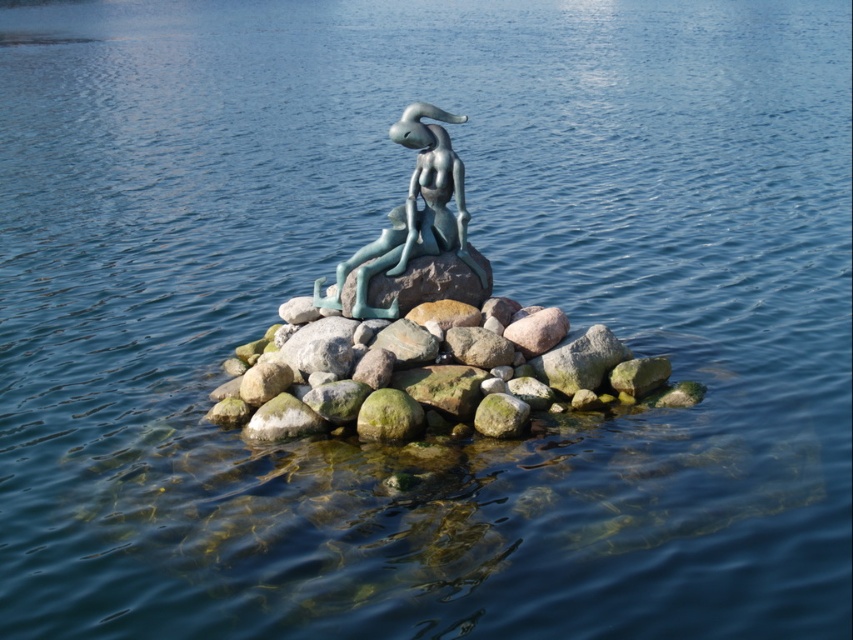
Is smooth gray rock at center wider than green patina statue at center?

No.

Is point (321, 333) in front of point (401, 209)?

Yes, point (321, 333) is closer to viewer.

Identify the location of smooth gray rock at center. (422, 374).